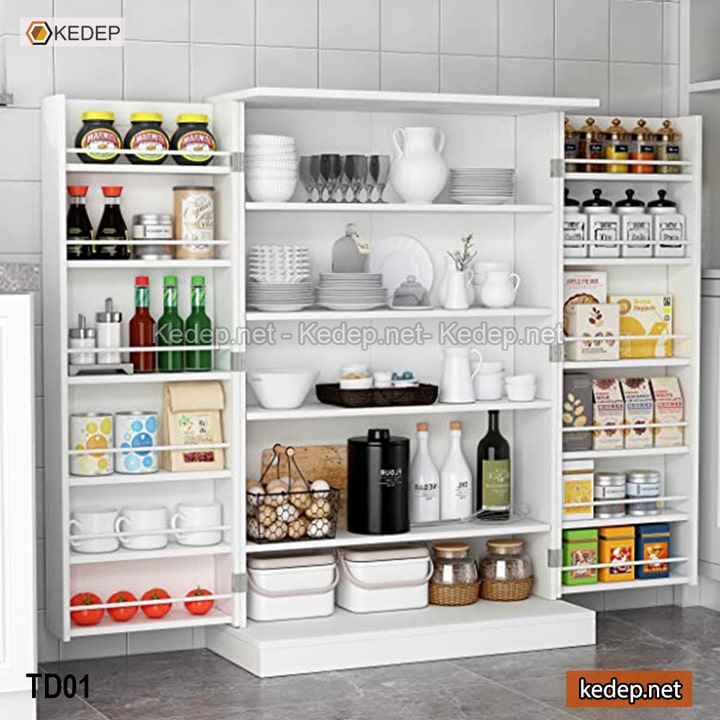
Image resolution: width=720 pixels, height=720 pixels. What are the coordinates of `stacks of plates` in the screenshot? It's located at (288, 291), (337, 297), (353, 276), (480, 174).